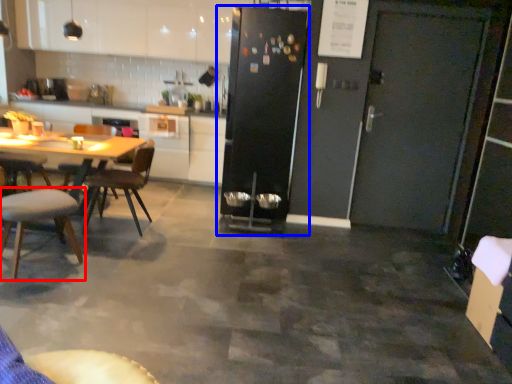
Question: Which object appears farthest to the camera in this image, chair (highlighted by a red box) or refrigerator (highlighted by a blue box)?

Choices:
 (A) chair
 (B) refrigerator

Answer: (B)